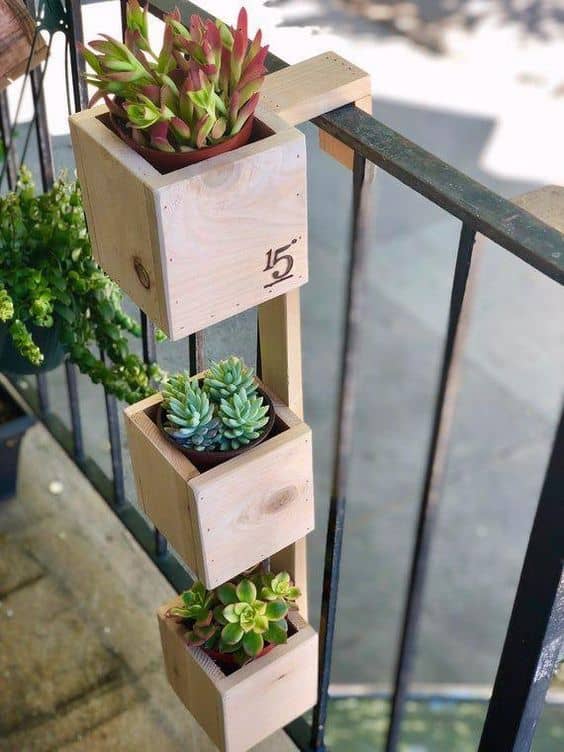
At what (x,y) coordinates should I click in order to perform the action: click on plant. Please return your answer as a coordinate pair (x, y). Looking at the image, I should click on click(255, 623).